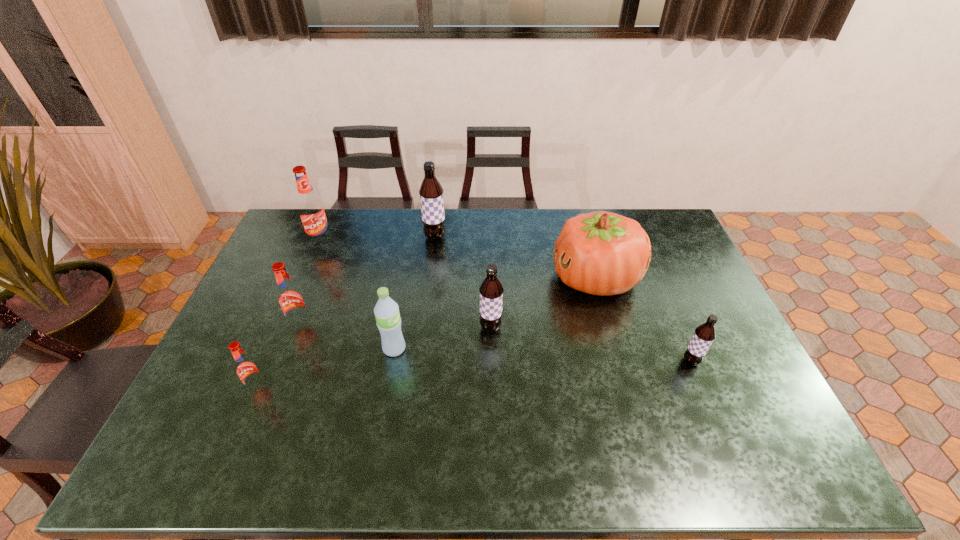
Locate an element on the screen. This screenshot has width=960, height=540. the farthest red root beer is located at coordinates (311, 210).

The width and height of the screenshot is (960, 540). Identify the location of the farthest brown root beer. (431, 192).

Locate an element on the screen. This screenshot has height=540, width=960. the leftmost brown root beer is located at coordinates (431, 192).

This screenshot has width=960, height=540. What are the coordinates of `green pumpkin` in the screenshot? It's located at (601, 253).

The image size is (960, 540). In order to click on the sixth nearest object in this screenshot , I will do `click(601, 253)`.

Where is `the second farthest brown root beer`? The image size is (960, 540). the second farthest brown root beer is located at coordinates (491, 290).

In order to click on the second biggest brown root beer in this screenshot , I will do `click(491, 290)`.

This screenshot has height=540, width=960. I want to click on the second farthest red root beer, so click(x=290, y=297).

What are the coordinates of `green water bottle` in the screenshot? It's located at (388, 320).

Locate an element on the screen. water bottle is located at coordinates (388, 320).